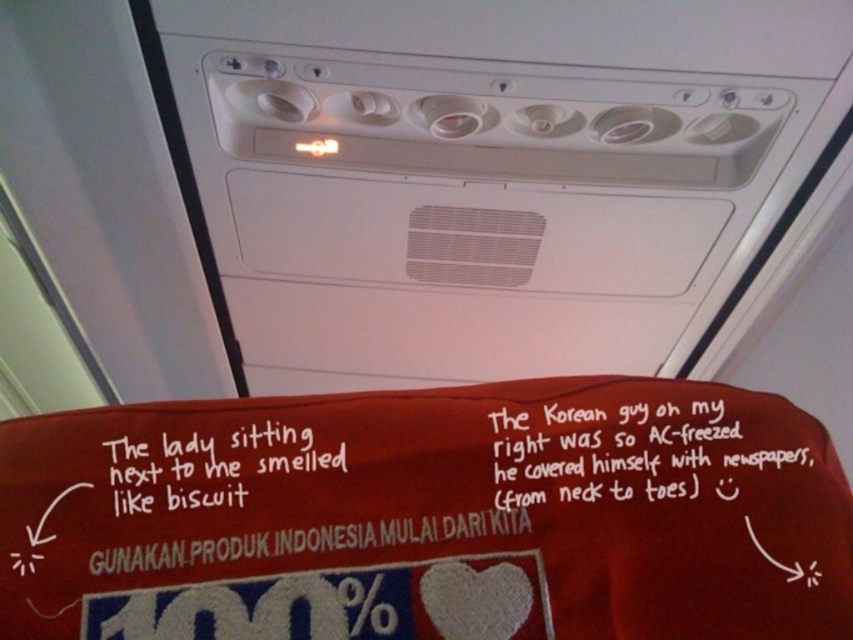
Find the location of a particular element. The image size is (853, 640). white plastic air vent at upper center is located at coordinates [x=498, y=179].

Is white plastic air vent at upper center behind white paper at upper center?

That is True.

At what (x,y) coordinates should I click in order to perform the action: click on white plastic air vent at upper center. Please return your answer as a coordinate pair (x, y). The width and height of the screenshot is (853, 640). Looking at the image, I should click on (498, 179).

Looking at this image, between white plastic air vent at upper center and white handwritten text at center, which one appears on the left side from the viewer's perspective?

From the viewer's perspective, white handwritten text at center appears more on the left side.

Between point (247, 141) and point (187, 435), which one is positioned behind?

The point (247, 141) is behind.

Identify the location of white plastic air vent at upper center. (498, 179).

Can you confirm if white paper at upper center is taller than white handwritten text at center?

Indeed, white paper at upper center has a greater height compared to white handwritten text at center.

Is white paper at upper center below white handwritten text at center?

Actually, white paper at upper center is above white handwritten text at center.

Where is `white paper at upper center`? white paper at upper center is located at coordinates (650, 445).